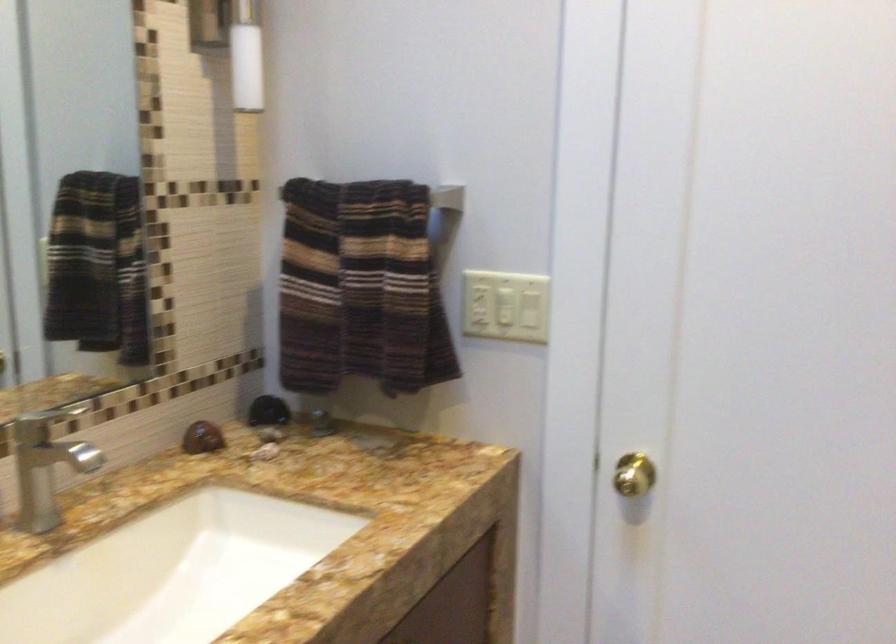
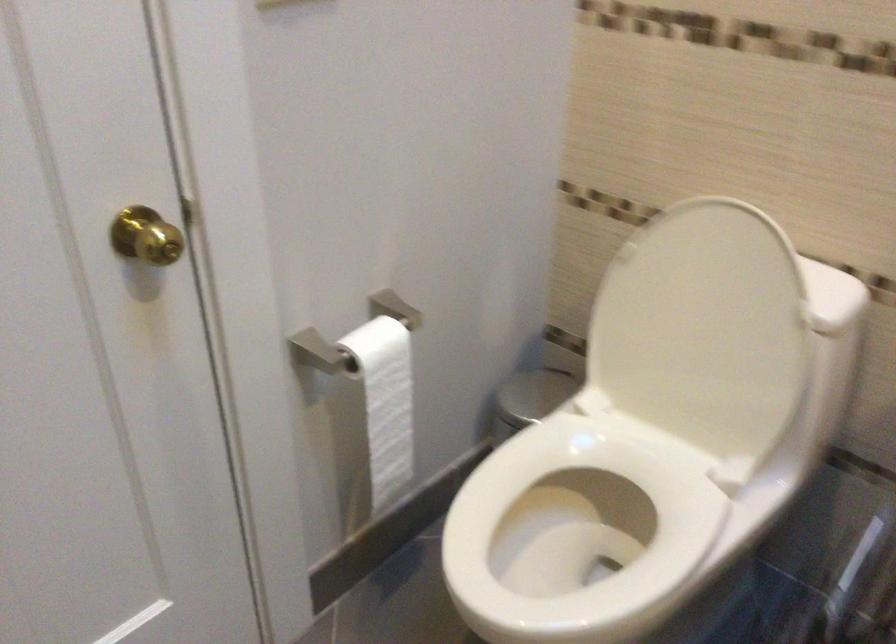
How did the camera likely rotate?

The camera rotated toward left-down.